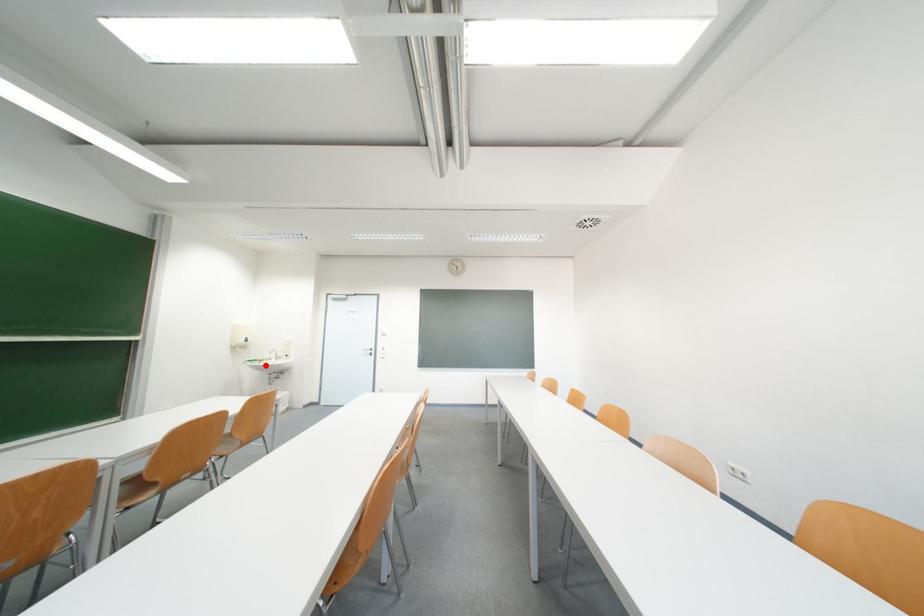
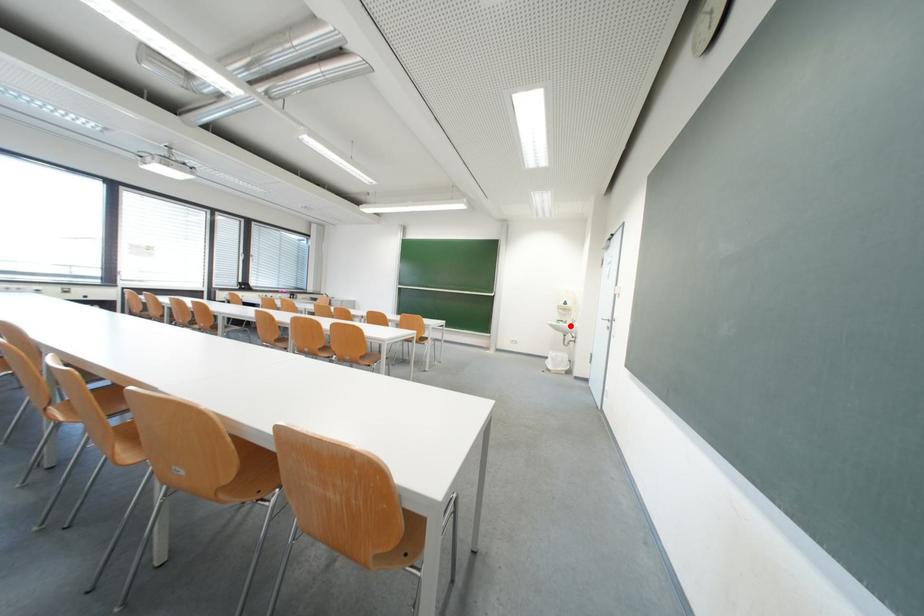
I am providing you with two images of the same scene from different viewpoints. A red point is marked on the first image and another point is marked on the second image. Is the marked point in image1 the same physical position as the marked point in image2?

Yes